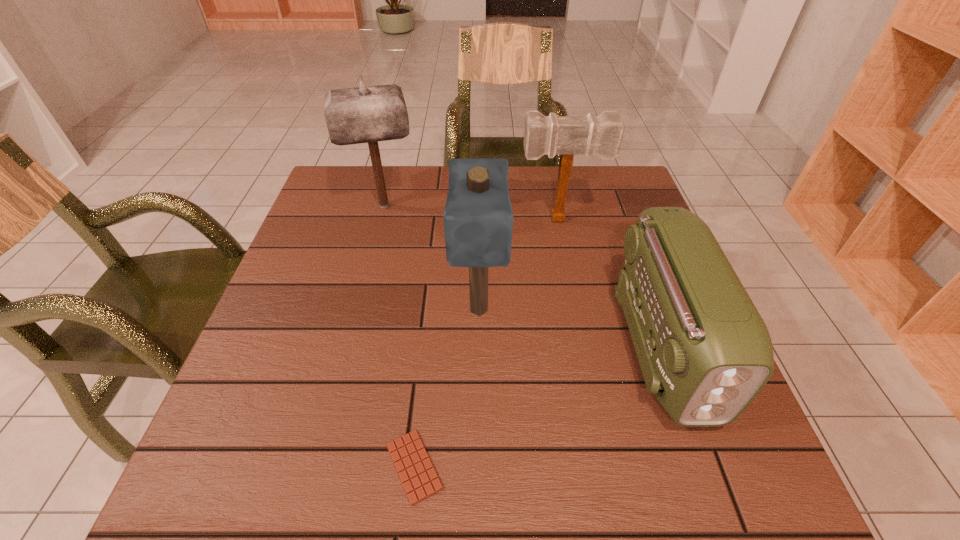
Find the location of a particular element. free location located on the right of the shortest object is located at coordinates (563, 467).

Locate an element on the screen. This screenshot has width=960, height=540. object situated at the near edge is located at coordinates (416, 472).

Identify the location of object present at the left edge. This screenshot has width=960, height=540. (363, 114).

Find the location of a particular element. Image resolution: width=960 pixels, height=540 pixels. mallet situated at the right edge is located at coordinates (601, 135).

The width and height of the screenshot is (960, 540). Find the location of `radio_receiver at the right edge`. radio_receiver at the right edge is located at coordinates (705, 352).

At what (x,y) coordinates should I click in order to perform the action: click on object present at the far left corner. Please return your answer as a coordinate pair (x, y). The height and width of the screenshot is (540, 960). Looking at the image, I should click on (363, 114).

Find the location of a particular element. object that is at the far right corner is located at coordinates (601, 135).

The width and height of the screenshot is (960, 540). In the image, there is a desktop. In order to click on free region at the far edge in this screenshot , I will do `click(443, 188)`.

Where is `vacant area at the near edge of the desktop`? This screenshot has width=960, height=540. vacant area at the near edge of the desktop is located at coordinates (640, 498).

In order to click on free region at the left edge in this screenshot , I will do `click(297, 254)`.